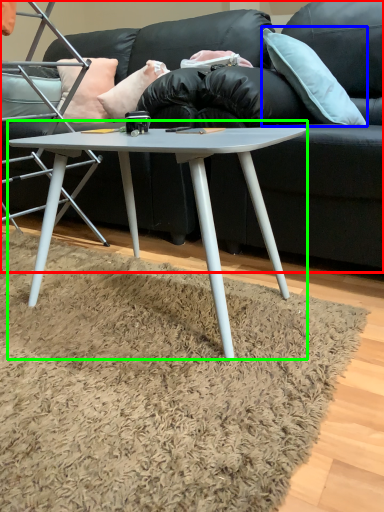
Question: Estimate the real-world distances between objects in this image. Which object is closer to studio couch (highlighted by a red box), pillow (highlighted by a blue box) or coffee table (highlighted by a green box)?

Choices:
 (A) pillow
 (B) coffee table

Answer: (A)